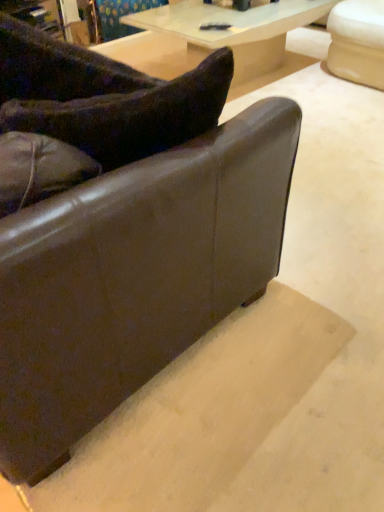
What do you see at coordinates (131, 115) in the screenshot? I see `velvety dark brown pillow at upper left` at bounding box center [131, 115].

Looking at this image, in order to face velvety dark brown pillow at upper left, should I rotate leftwards or rightwards?

Turn left approximately 14.724 degrees to face it.

What are the coordinates of `brown leather couch at lower left` in the screenshot? It's located at (121, 230).

Where is `velvety dark brown pillow at upper left`? velvety dark brown pillow at upper left is located at coordinates (131, 115).

In the image, is translucent glass table at upper center positioned in front of or behind brown leather couch at lower left?

Visually, translucent glass table at upper center is located behind brown leather couch at lower left.

Between translucent glass table at upper center and brown leather couch at lower left, which one has more height?

Standing taller between the two is brown leather couch at lower left.

Who is bigger, translucent glass table at upper center or brown leather couch at lower left?

brown leather couch at lower left.

Is translucent glass table at upper center aimed at brown leather couch at lower left?

No, translucent glass table at upper center is not facing towards brown leather couch at lower left.

Which object is closer to the camera, brown leather couch at lower left or velvety dark brown pillow at upper left?

brown leather couch at lower left is in front.

Is brown leather couch at lower left not near velvety dark brown pillow at upper left?

brown leather couch at lower left is near velvety dark brown pillow at upper left, not far away.

Considering the positions of objects brown leather couch at lower left and velvety dark brown pillow at upper left in the image provided, who is more to the left, brown leather couch at lower left or velvety dark brown pillow at upper left?

brown leather couch at lower left is more to the left.

Is point (94, 91) behind point (136, 98)?

Yes, point (94, 91) is farther from viewer.

Is velvety dark brown pillow at upper left in front of or behind brown leather couch at lower left in the image?

velvety dark brown pillow at upper left is behind brown leather couch at lower left.

Is velvety dark brown pillow at upper left placed right next to brown leather couch at lower left?

No, velvety dark brown pillow at upper left is not beside brown leather couch at lower left.

Which point is more distant from viewer, (203, 123) or (84, 412)?

The point (84, 412) is farther.

Consider the image. What's the angular difference between velvety dark brown pillow at upper left and brown leather couch at lower left's facing directions?

velvety dark brown pillow at upper left and brown leather couch at lower left are facing 57.7 degrees away from each other.

Looking at their sizes, would you say brown leather couch at lower left is wider or thinner than translucent glass table at upper center?

Clearly, brown leather couch at lower left has more width compared to translucent glass table at upper center.

From a real-world perspective, between brown leather couch at lower left and translucent glass table at upper center, who is vertically lower?

translucent glass table at upper center.

Is brown leather couch at lower left not inside translucent glass table at upper center?

That's correct, brown leather couch at lower left is outside of translucent glass table at upper center.

Which object is closer to the camera taking this photo, brown leather couch at lower left or translucent glass table at upper center?

brown leather couch at lower left is more forward.

From a real-world perspective, is velvety dark brown pillow at upper left located higher than translucent glass table at upper center?

Yes, from a real-world perspective, velvety dark brown pillow at upper left is above translucent glass table at upper center.

Is velvety dark brown pillow at upper left to the right of translucent glass table at upper center from the viewer's perspective?

No, velvety dark brown pillow at upper left is not to the right of translucent glass table at upper center.

Is translucent glass table at upper center at the back of velvety dark brown pillow at upper left?

No, velvety dark brown pillow at upper left is not facing away from translucent glass table at upper center.

Where is `pillow on the left of translucent glass table at upper center`? The image size is (384, 512). pillow on the left of translucent glass table at upper center is located at coordinates (131, 115).

Considering the positions of objects translucent glass table at upper center and velvety dark brown pillow at upper left in the image provided, who is more to the left, translucent glass table at upper center or velvety dark brown pillow at upper left?

velvety dark brown pillow at upper left is more to the left.

Between point (255, 66) and point (133, 104), which one is positioned in front?

The point (133, 104) is closer.

Can you confirm if translucent glass table at upper center is shorter than velvety dark brown pillow at upper left?

In fact, translucent glass table at upper center may be taller than velvety dark brown pillow at upper left.

Where is `table above the velvety dark brown pillow at upper left (from the image's perspective)`? This screenshot has height=512, width=384. table above the velvety dark brown pillow at upper left (from the image's perspective) is located at coordinates (234, 31).

Identify the location of table below the brown leather couch at lower left (from a real-world perspective). This screenshot has height=512, width=384. (234, 31).

Locate an element on the screen. studio couch on the left of velvety dark brown pillow at upper left is located at coordinates (121, 230).

Looking at the image, which one is located further to brown leather couch at lower left, velvety dark brown pillow at upper left or translucent glass table at upper center?

translucent glass table at upper center lies further to brown leather couch at lower left than the other object.

From the image, which object appears to be nearer to velvety dark brown pillow at upper left, brown leather couch at lower left or translucent glass table at upper center?

The object closer to velvety dark brown pillow at upper left is brown leather couch at lower left.

Which object lies nearer to the anchor point translucent glass table at upper center, velvety dark brown pillow at upper left or brown leather couch at lower left?

brown leather couch at lower left lies closer to translucent glass table at upper center than the other object.

In the scene shown: Looking at the image, which one is located further to translucent glass table at upper center, brown leather couch at lower left or velvety dark brown pillow at upper left?

Among the two, velvety dark brown pillow at upper left is located further to translucent glass table at upper center.

When comparing their distances from velvety dark brown pillow at upper left, does translucent glass table at upper center or brown leather couch at lower left seem further?

Based on the image, translucent glass table at upper center appears to be further to velvety dark brown pillow at upper left.

Considering their positions, is translucent glass table at upper center positioned closer to brown leather couch at lower left than velvety dark brown pillow at upper left?

velvety dark brown pillow at upper left.

You are a GUI agent. You are given a task and a screenshot of the screen. Output one action in this format:
    pyautogui.click(x=<x>, y=<y>)
    Task: Click on the pillow between brown leather couch at lower left and translucent glass table at upper center from front to back
    The width and height of the screenshot is (384, 512).
    Given the screenshot: What is the action you would take?
    pyautogui.click(x=131, y=115)